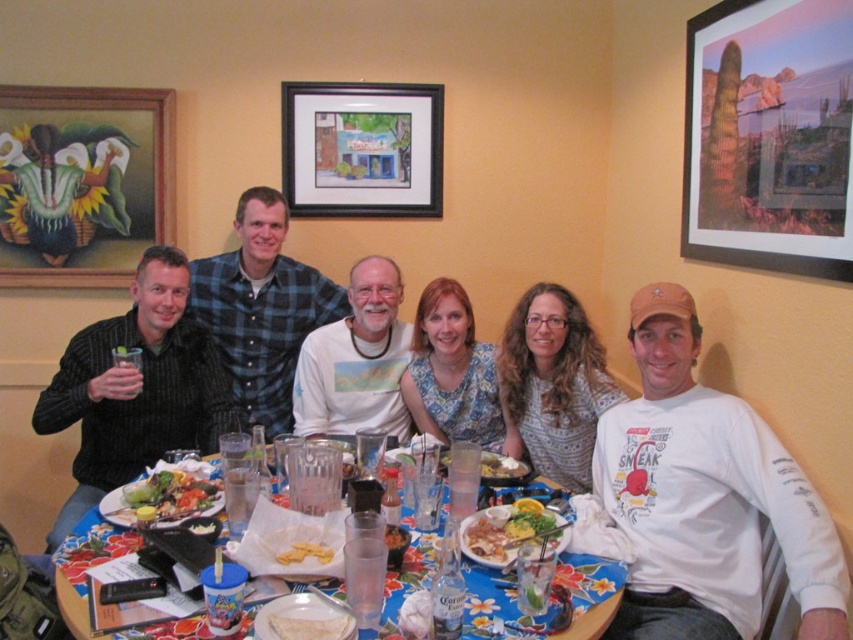
You are a photographer standing at the camera position. You want to take a closeup photo of the shiny plastic plate at center. Can you reach it without moving your feet?

The shiny plastic plate at center is 4.70 feet away from camera, so yes, you can reach it without moving your feet since it is within a comfortable distance for a photographer to capture a closeup.

You are standing 3 meters away from a dining table with a floral tablecloth. There is a point at coordinates [316,269] on the table. Can you reach that point without moving closer to the table?

The distance of point [316,269] from viewer is 2.96 meters, so yes, you can reach that point without moving closer since it is within your current distance of 3 meters.